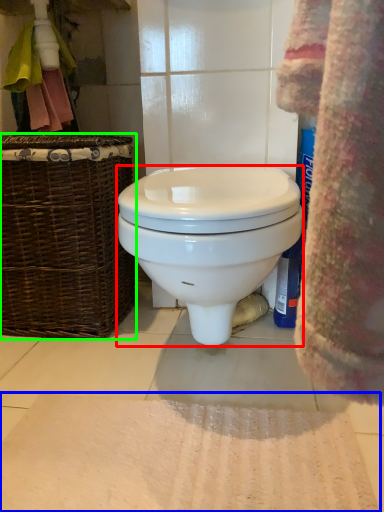
Question: Which object is the farthest from toilet (highlighted by a red box)? Choose among these: bath mat (highlighted by a blue box) or picnic basket (highlighted by a green box).

Choices:
 (A) bath mat
 (B) picnic basket

Answer: (A)